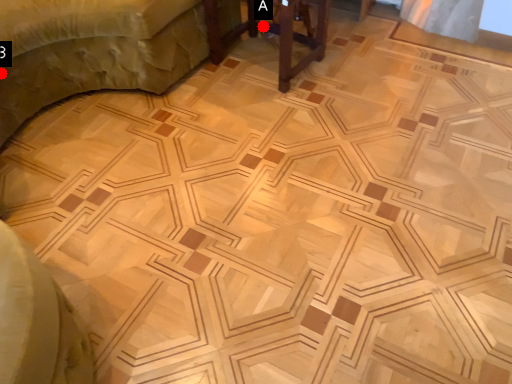
Question: Two points are circled on the image, labeled by A and B beside each circle. Among these points, which one is nearest to the camera?

Choices:
 (A) A is closer
 (B) B is closer

Answer: (B)